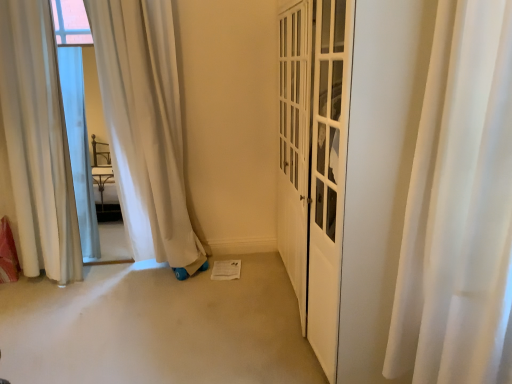
Where is `vacant space underneath white sheer curtain at left, which is counted as the second curtain, starting from the front (from a real-world perspective)`? The image size is (512, 384). vacant space underneath white sheer curtain at left, which is counted as the second curtain, starting from the front (from a real-world perspective) is located at coordinates (33, 285).